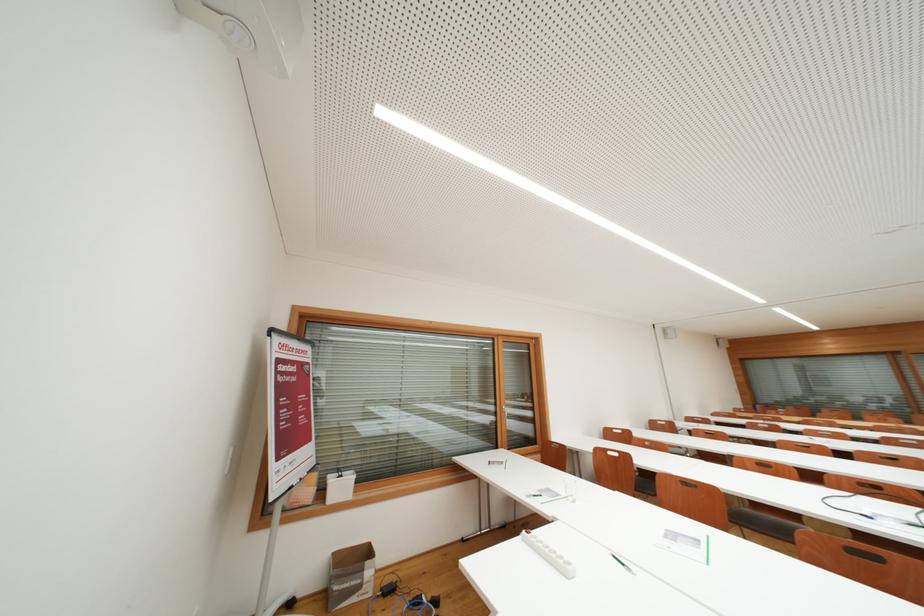
I want to click on metal window handle, so click(604, 407).